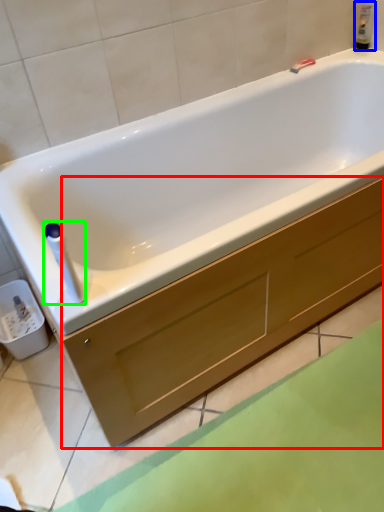
Question: Based on their relative distances, which object is farther from drawer (highlighted by a red box)? Choose from bottle (highlighted by a blue box) and towel bar (highlighted by a green box).

Choices:
 (A) bottle
 (B) towel bar

Answer: (A)